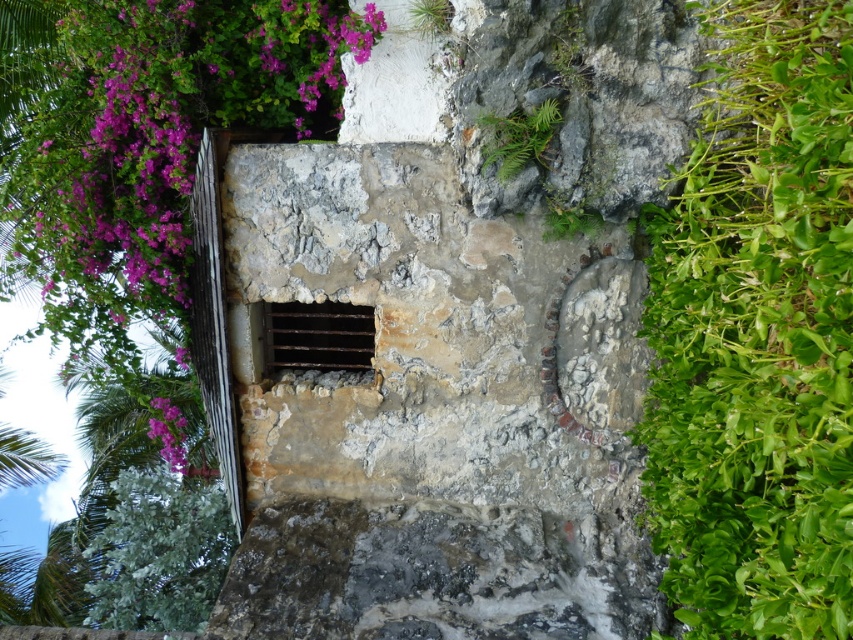
Question: Considering the relative positions of green leafy plant at right and purple matte flower at upper left in the image provided, where is green leafy plant at right located with respect to purple matte flower at upper left?

Choices:
 (A) right
 (B) left

Answer: (A)

Question: Observing the image, what is the correct spatial positioning of green leafy plant at right in reference to purple matte flower at upper left?

Choices:
 (A) left
 (B) right

Answer: (B)

Question: Which point is closer to the camera taking this photo?

Choices:
 (A) (173, 467)
 (B) (689, 211)

Answer: (B)

Question: Does green leafy plant at right appear over purple matte flower at upper left?

Choices:
 (A) yes
 (B) no

Answer: (A)

Question: Which of the following is the farthest from the observer?

Choices:
 (A) (773, 236)
 (B) (184, 426)

Answer: (B)